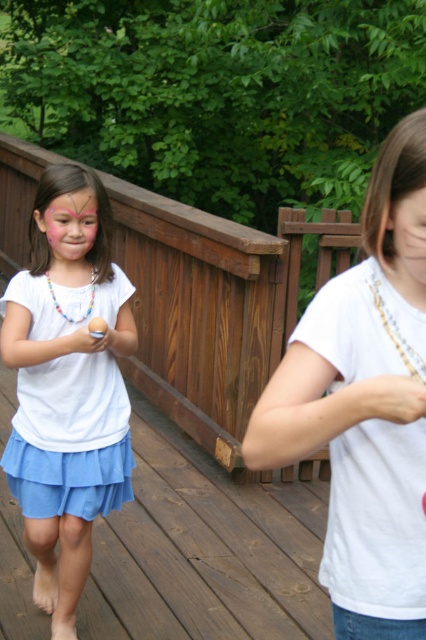
Who is shorter, light blue chiffon skirt at left or matte white hand at center?

With less height is matte white hand at center.

Between light blue chiffon skirt at left and matte white hand at center, which one is positioned lower?

light blue chiffon skirt at left

What do you see at coordinates (69, 436) in the screenshot? I see `light blue chiffon skirt at left` at bounding box center [69, 436].

The image size is (426, 640). I want to click on light blue chiffon skirt at left, so click(69, 436).

Between matte white hand at center and multicolored beaded necklace at left, which one has less height?

Standing shorter between the two is matte white hand at center.

Does point (83, 342) come in front of point (89, 301)?

Yes, point (83, 342) is closer to viewer.

What do you see at coordinates (86, 340) in the screenshot? The width and height of the screenshot is (426, 640). I see `matte white hand at center` at bounding box center [86, 340].

Where is `matte white hand at center`? The image size is (426, 640). matte white hand at center is located at coordinates (86, 340).

Who is more distant from viewer, [376,388] or [89,298]?

Positioned behind is point [89,298].

The width and height of the screenshot is (426, 640). Find the location of `white matte hand at center`. white matte hand at center is located at coordinates (385, 400).